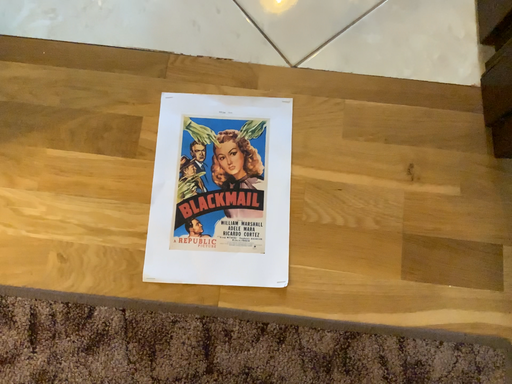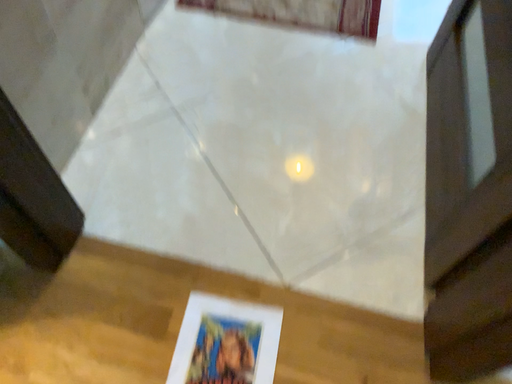
Question: Which way did the camera rotate in the video?

Choices:
 (A) rotated upward
 (B) rotated downward

Answer: (A)